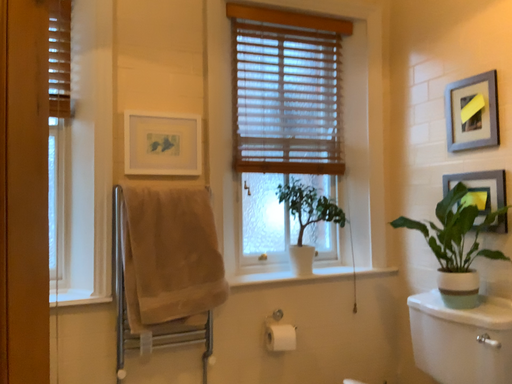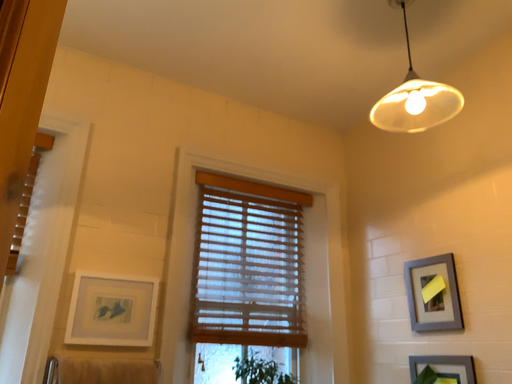
Question: Which way did the camera rotate in the video?

Choices:
 (A) rotated left
 (B) rotated right

Answer: (B)